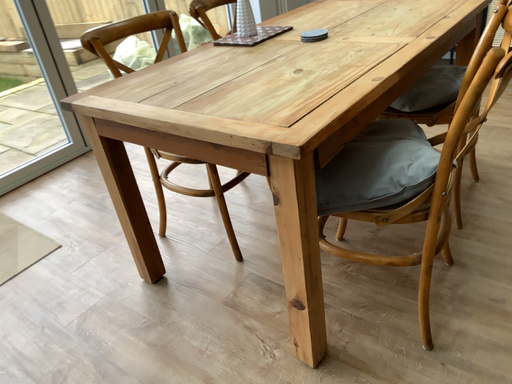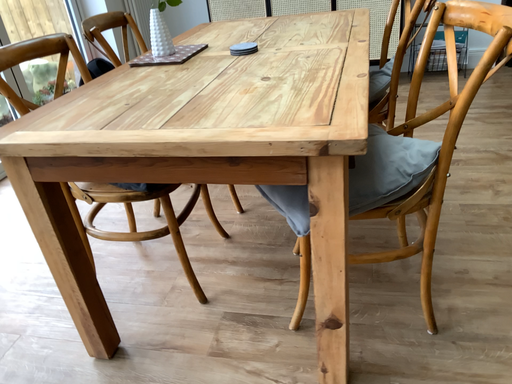
Question: How did the camera likely rotate when shooting the video?

Choices:
 (A) rotated upward
 (B) rotated downward

Answer: (A)